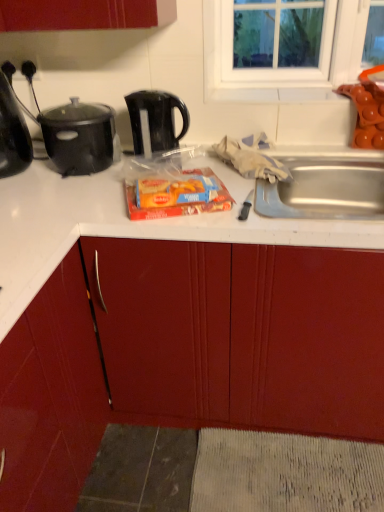
Locate an element on the screen. free location in front of black matte pot at upper left is located at coordinates (66, 195).